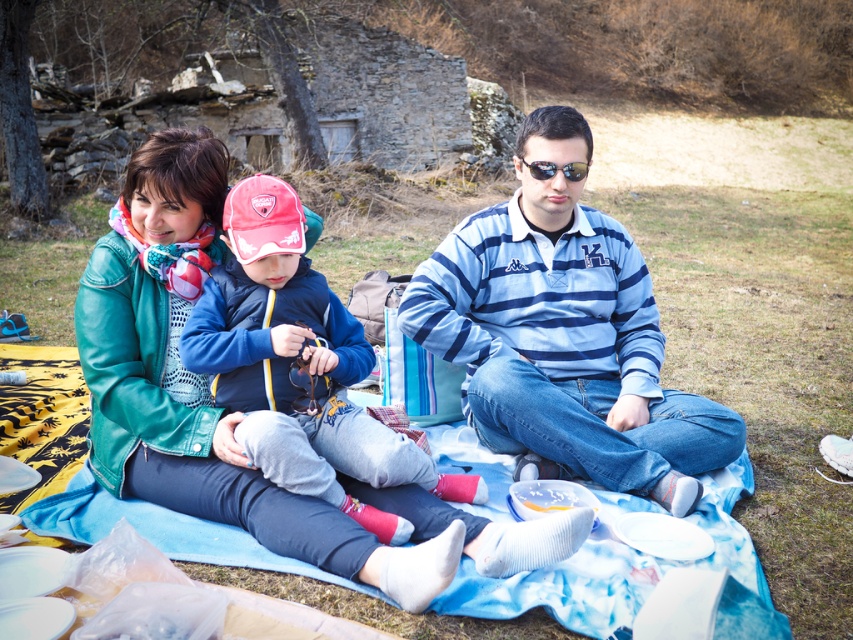
Question: Which point is closer to the camera?

Choices:
 (A) sunglasses at center
 (B) blue fleece jacket at center

Answer: (B)

Question: Which point is farther to the camera?

Choices:
 (A) (329, 337)
 (B) (566, 166)

Answer: (B)

Question: Is blue striped jersey at center above sunglasses at center?

Choices:
 (A) yes
 (B) no

Answer: (B)

Question: Is blue striped polo shirt at center smaller than blue striped jersey at center?

Choices:
 (A) yes
 (B) no

Answer: (B)

Question: Which object is closer to the camera taking this photo?

Choices:
 (A) blue fleece jacket at center
 (B) sunglasses at center
 (C) blue striped polo shirt at center

Answer: (A)

Question: Observing the image, what is the correct spatial positioning of blue striped polo shirt at center in reference to blue fleece jacket at center?

Choices:
 (A) left
 (B) right

Answer: (B)